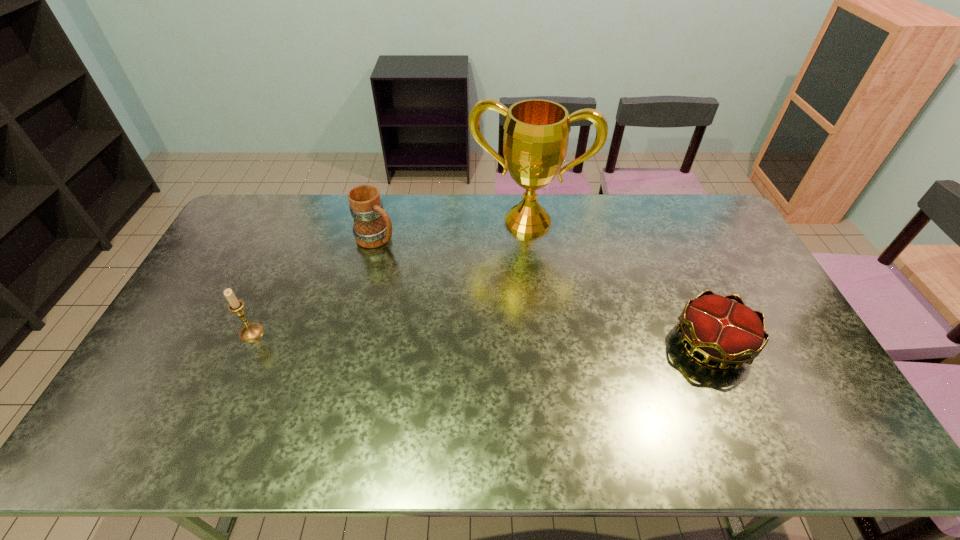
The height and width of the screenshot is (540, 960). I want to click on vacant space at the right edge of the desktop, so [700, 249].

Identify the location of free spot at the far right corner of the desktop. pos(690,206).

At what (x,y) coordinates should I click in order to perform the action: click on vacant area at the near right corner. Please return your answer as a coordinate pair (x, y). The image size is (960, 540). Looking at the image, I should click on (826, 388).

This screenshot has height=540, width=960. I want to click on free space between the mug and the leftmost object, so click(x=314, y=286).

At what (x,y) coordinates should I click in order to perform the action: click on free space between the tallest object and the second object from left to right. Please return your answer as a coordinate pair (x, y). Looking at the image, I should click on (452, 230).

Locate an element on the screen. This screenshot has width=960, height=540. vacant point located between the award and the shortest object is located at coordinates (620, 282).

In order to click on vacant area between the rightmost object and the mug in this screenshot , I will do `click(544, 291)`.

At what (x,y) coordinates should I click in order to perform the action: click on free point between the second object from left to right and the rightmost object. Please return your answer as a coordinate pair (x, y). Looking at the image, I should click on (544, 291).

This screenshot has height=540, width=960. What are the coordinates of `vacant area that lies between the shortest object and the third object from right to left` in the screenshot? It's located at (544, 291).

You are a GUI agent. You are given a task and a screenshot of the screen. Output one action in this format:
    pyautogui.click(x=<x>, y=<y>)
    Task: Click on the unoccupied area between the second object from right to left and the mug
    The image size is (960, 540).
    Given the screenshot: What is the action you would take?
    pyautogui.click(x=452, y=230)